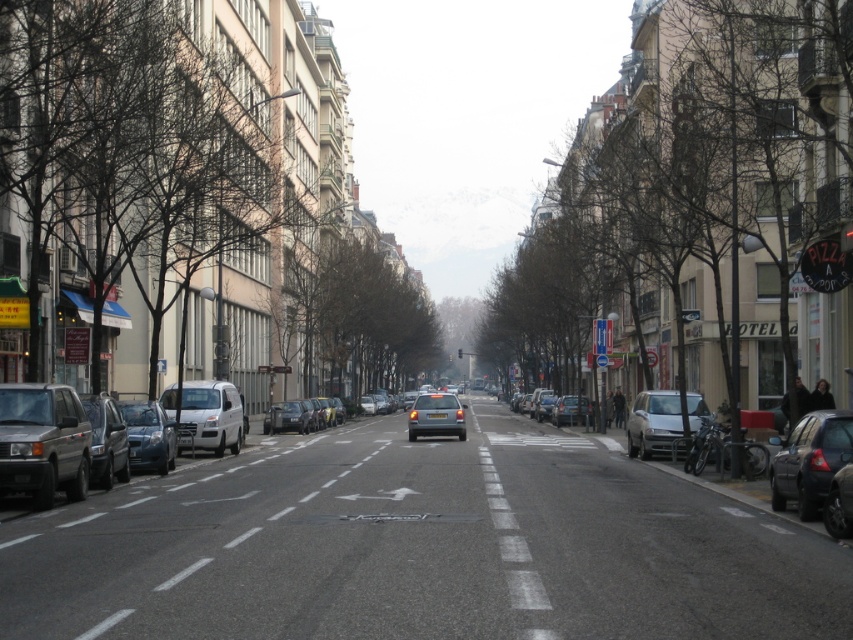
You are a pedestrian standing at the crosswalk and need to cross the street. There is a matte silver van at left and a silver metallic car at center. Which vehicle is closer to your left side?

The matte silver van at left is closer to your left side since it is positioned to the left of the silver metallic car at center.

You are a pedestrian standing at the crosswalk and want to cross the street safely. You see a matte silver van at left and a silver metallic car at center. Which vehicle is closer to you as you wait on the crosswalk?

The matte silver van at left is closer to you because it is in front of the silver metallic car at center, meaning it is positioned nearer to your location at the crosswalk.